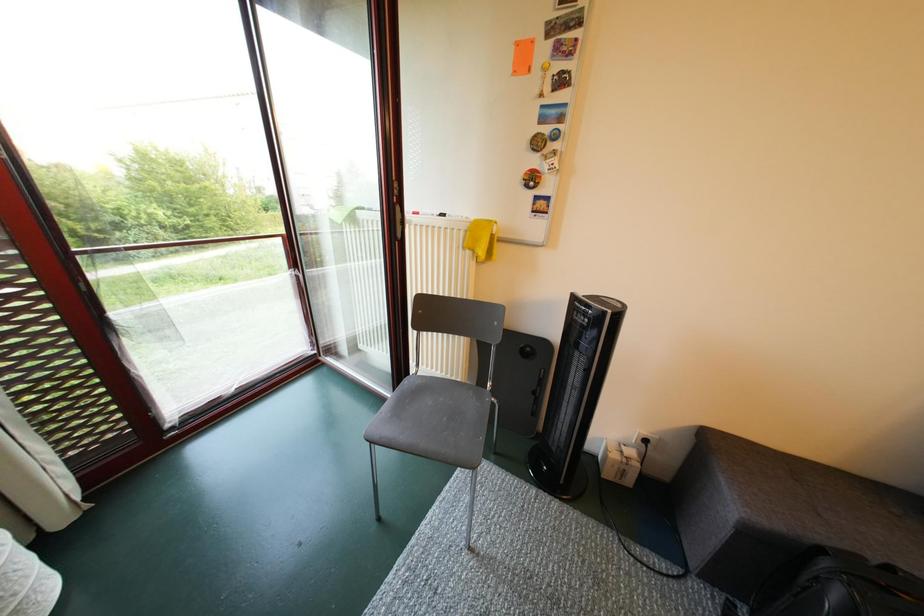
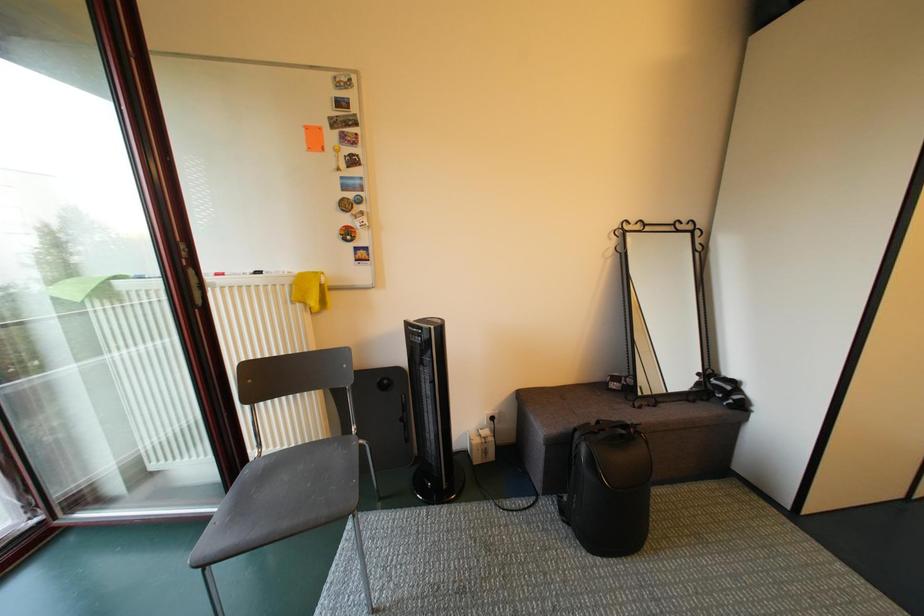
Question: The first image is from the beginning of the video and the second image is from the end. How did the camera likely rotate when shooting the video?

Choices:
 (A) Left
 (B) Right
 (C) Up
 (D) Down

Answer: (B)